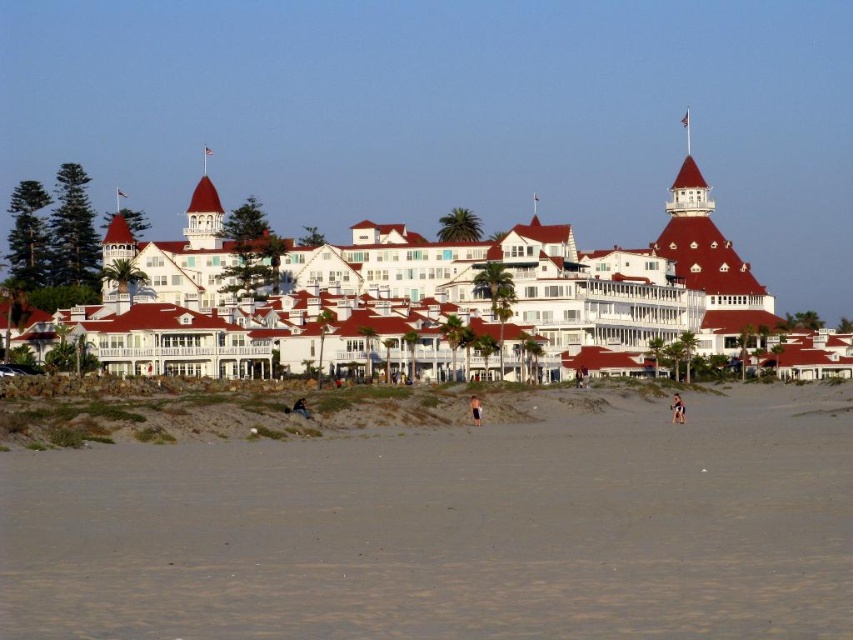
You are standing on the beach and see the white wood resort at center and the brown leather jacket at center. Which object is positioned more to the right?

The white wood resort at center is positioned more to the right than the brown leather jacket at center.